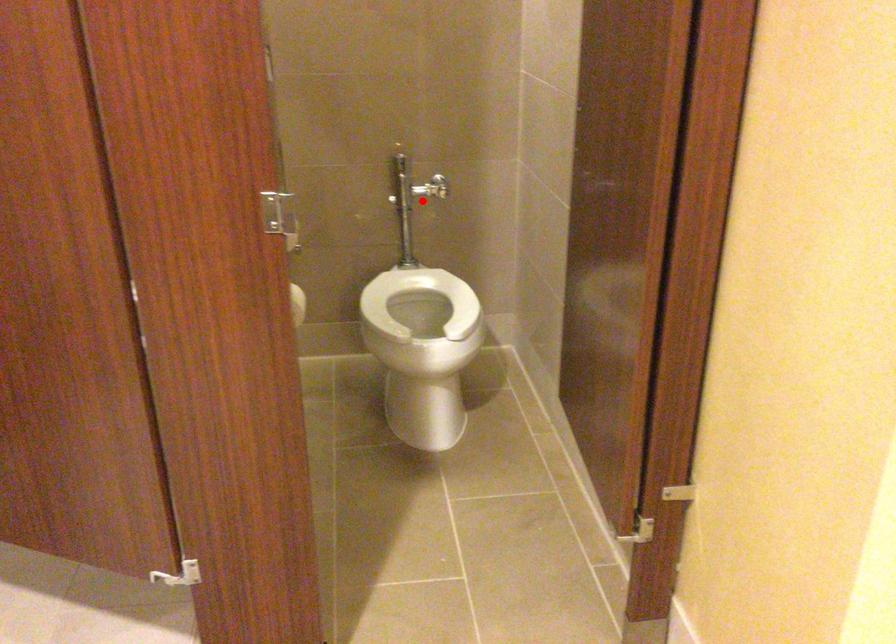
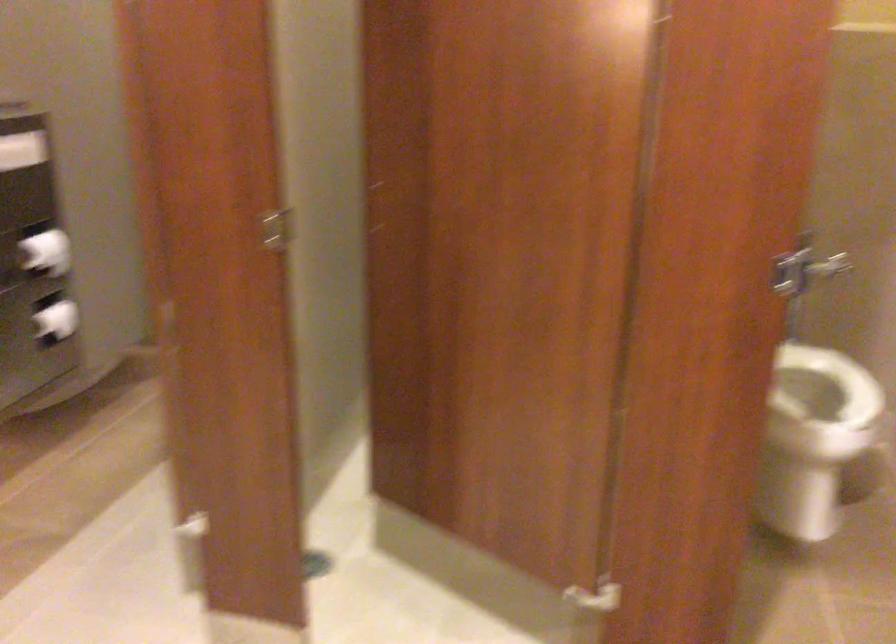
Question: A red point is marked in image1. In image2, is the corresponding 3D point closer to the camera or farther? Reply with the corresponding letter.

Choices:
 (A) The corresponding 3D point is closer.
 (B) The corresponding 3D point is farther.

Answer: (A)